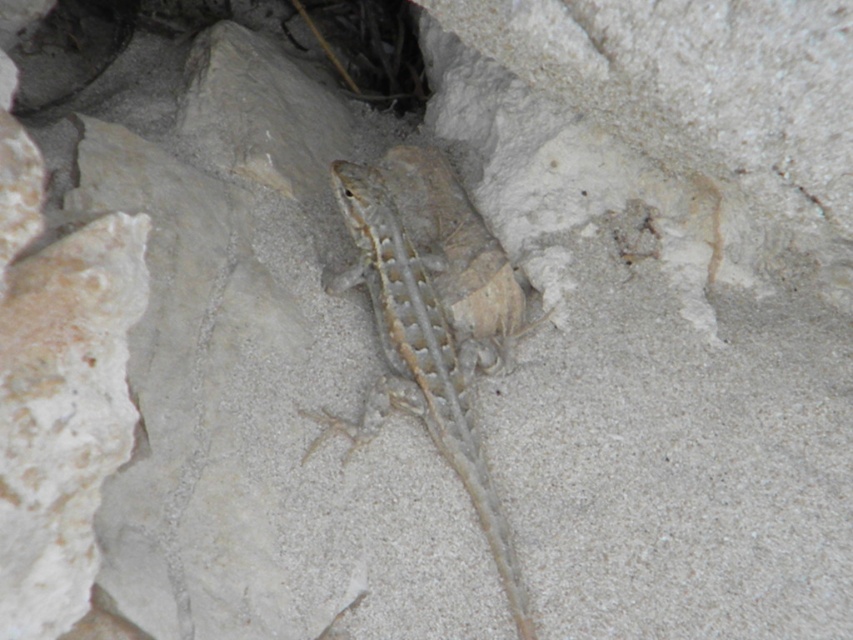
You are a geologist examining the terrain. You notice the desert gray scaly lizard at center and the smooth stone hole at upper left. Which object is positioned higher in the image?

The smooth stone hole at upper left is positioned higher in the image than the desert gray scaly lizard at center.

You are a geologist examining the terrain. You need to determine if the desert gray scaly lizard at center can fit into the smooth stone hole at upper left based on their sizes. Can it fit?

The desert gray scaly lizard at center is taller than the smooth stone hole at upper left, so it cannot fit into the hole.

You are a geologist studying the rock formations in this desert environment. You notice a point of interest at point (x=425, y=353). What object is located at that point?

The desert gray scaly lizard at center is located at point (x=425, y=353).